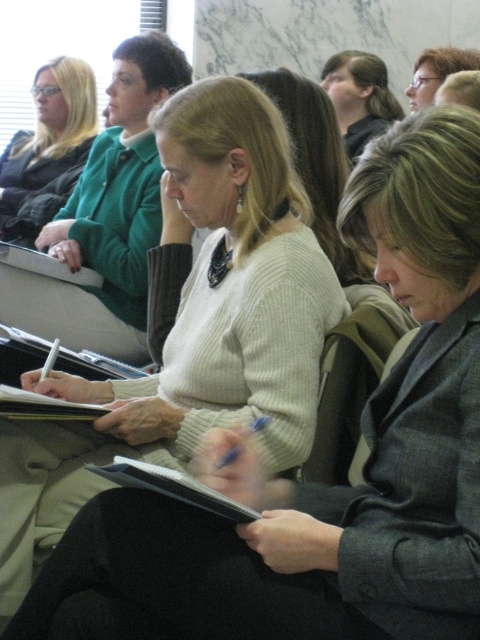
Question: Can you confirm if white knit sweater at center is positioned below matte black hair at upper center?

Choices:
 (A) yes
 (B) no

Answer: (A)

Question: Which point appears farthest from the camera in this image?

Choices:
 (A) (179, 472)
 (B) (74, 93)
 (C) (447, 56)
 (D) (360, 100)

Answer: (B)

Question: Is matte green sweater at upper left to the left of light beige sweater at center from the viewer's perspective?

Choices:
 (A) no
 (B) yes

Answer: (B)

Question: Which of the following is the farthest from the observer?

Choices:
 (A) (319, 234)
 (B) (220, 499)
 (C) (410, 86)

Answer: (C)

Question: Among these objects, which one is nearest to the camera?

Choices:
 (A) black matte notebook at center
 (B) matte green sweater at upper left
 (C) white paper notebook at center

Answer: (A)

Question: Does matte black hair at upper center have a smaller size compared to black matte notebook at center?

Choices:
 (A) no
 (B) yes

Answer: (A)